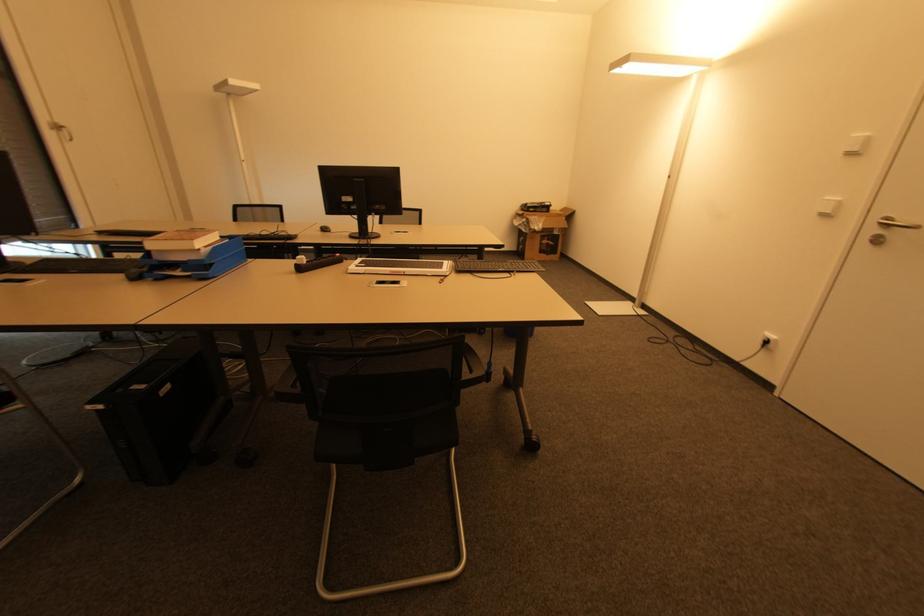
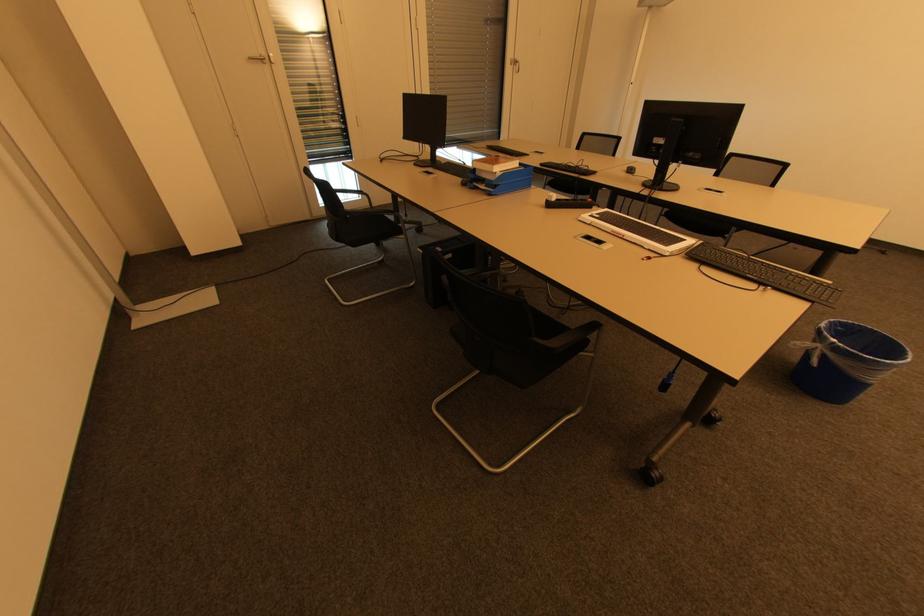
The point at (x=301, y=270) is marked in the first image. Where is the corresponding point in the second image?

(551, 206)